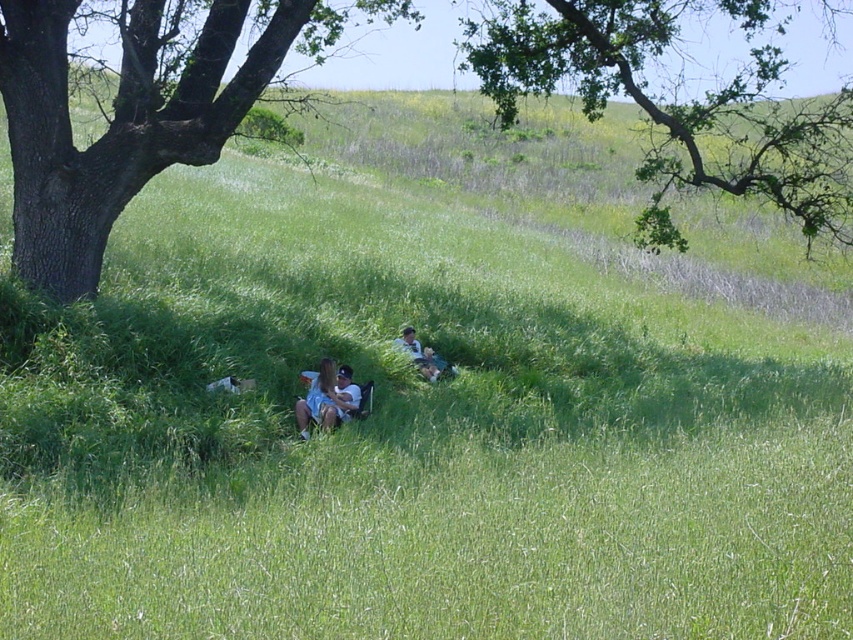
You are planning to set up a picnic blanket in this grassy field. Considering the presence of the brown rough tree at left and the light blue denim shorts at center, which object would you need to avoid placing the blanket too close to due to its size?

The brown rough tree at left is larger in size than the light blue denim shorts at center, so you should avoid placing the blanket too close to the brown rough tree at left to ensure there is enough space.